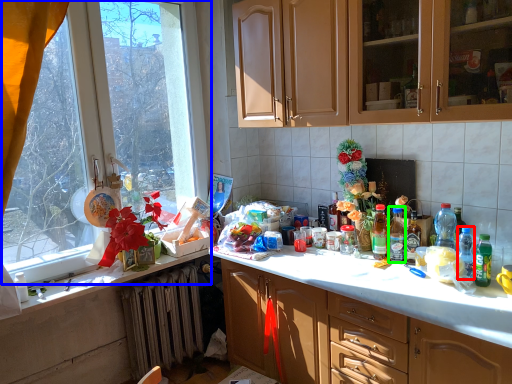
Question: Which is nearer to the bottle (highlighted by a red box)? window (highlighted by a blue box) or bottle (highlighted by a green box).

Choices:
 (A) window
 (B) bottle

Answer: (B)